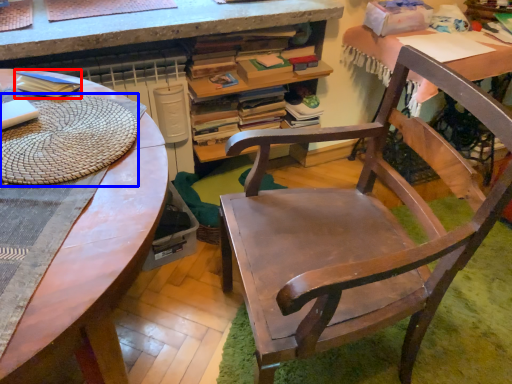
Question: Which object is closer to the camera taking this photo, paperback book (highlighted by a red box) or mat (highlighted by a blue box)?

Choices:
 (A) paperback book
 (B) mat

Answer: (B)